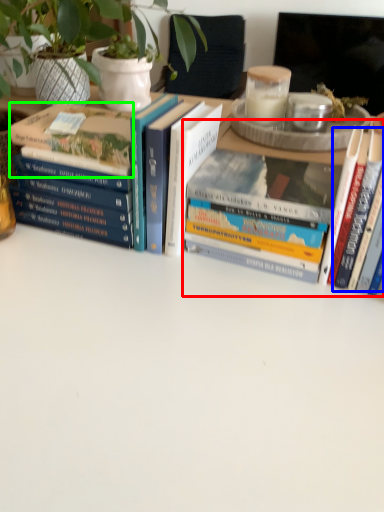
Question: Based on their relative distances, which object is nearer to book (highlighted by a red box)? Choose from book (highlighted by a blue box) and book (highlighted by a green box).

Choices:
 (A) book
 (B) book

Answer: (A)